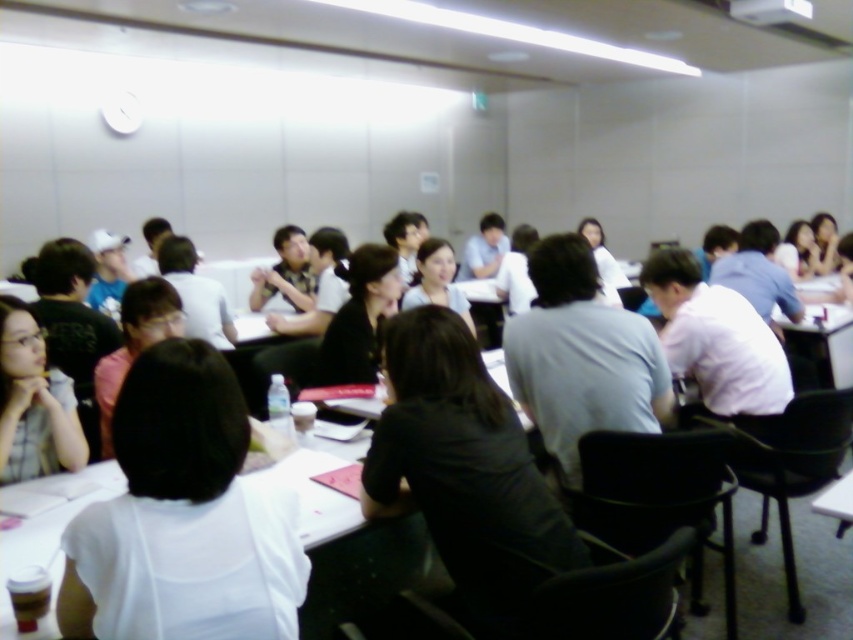
Between point (265, 592) and point (358, 376), which one is positioned behind?

The point (358, 376) is behind.

Does white paper at center have a greater width compared to black matte shirt at center?

Yes, white paper at center is wider than black matte shirt at center.

Which is behind, point (281, 490) or point (396, 268)?

Positioned behind is point (396, 268).

At what (x,y) coordinates should I click in order to perform the action: click on white paper at center. Please return your answer as a coordinate pair (x, y). Looking at the image, I should click on (183, 516).

Can you confirm if white paper at center is thinner than matte black glasses at lower left?

Incorrect, white paper at center's width is not less than matte black glasses at lower left's.

Which is above, white paper at center or matte black glasses at lower left?

Positioned higher is matte black glasses at lower left.

Who is more distant from viewer, (294, 598) or (56, 378)?

The point (56, 378) is behind.

This screenshot has width=853, height=640. Find the location of `white paper at center`. white paper at center is located at coordinates (183, 516).

Who is positioned more to the right, matte black glasses at lower left or black matte shirt at center?

From the viewer's perspective, black matte shirt at center appears more on the right side.

Which is above, matte black glasses at lower left or black matte shirt at center?

Positioned higher is black matte shirt at center.

Between point (53, 401) and point (337, 352), which one is positioned in front?

Positioned in front is point (53, 401).

What are the coordinates of `matte black glasses at lower left` in the screenshot? It's located at (33, 403).